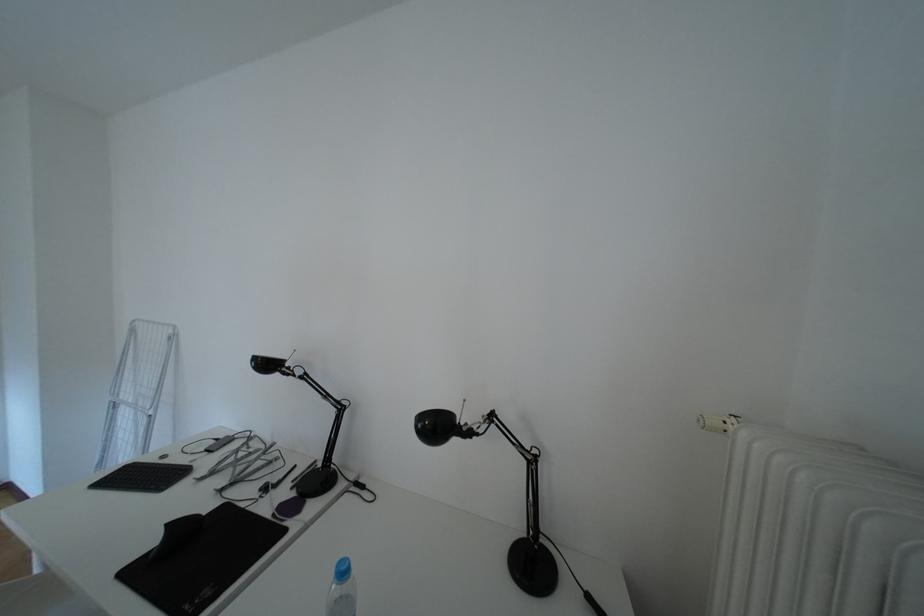
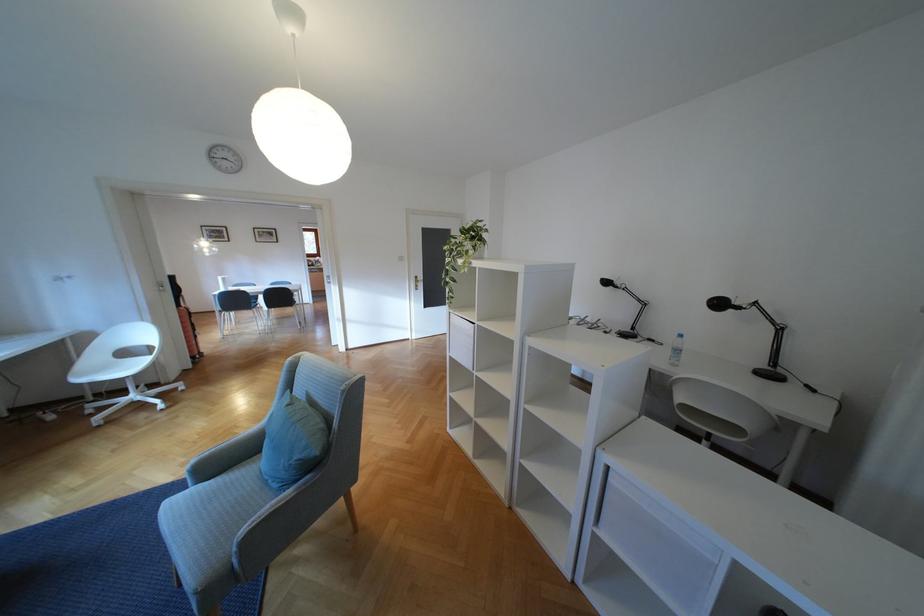
The point at (472, 419) is marked in the first image. Where is the corresponding point in the second image?

(746, 302)